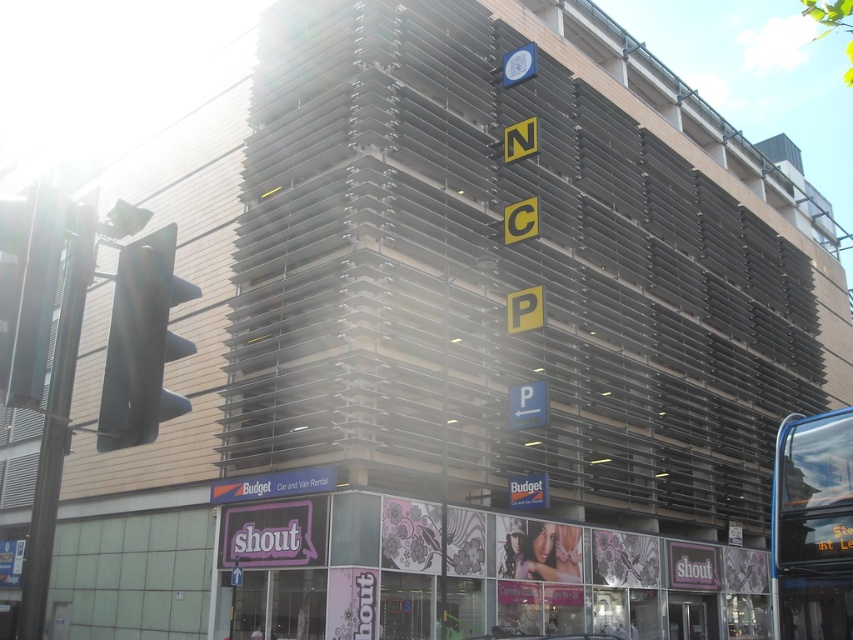
In the scene shown: Is the position of transparent glass bus at lower right more distant than that of black plastic traffic light at left?

Yes, it is.

Which is in front, point (815, 545) or point (125, 422)?

Point (125, 422)

At what (x,y) coordinates should I click in order to perform the action: click on transparent glass bus at lower right. Please return your answer as a coordinate pair (x, y). Image resolution: width=853 pixels, height=640 pixels. Looking at the image, I should click on (811, 525).